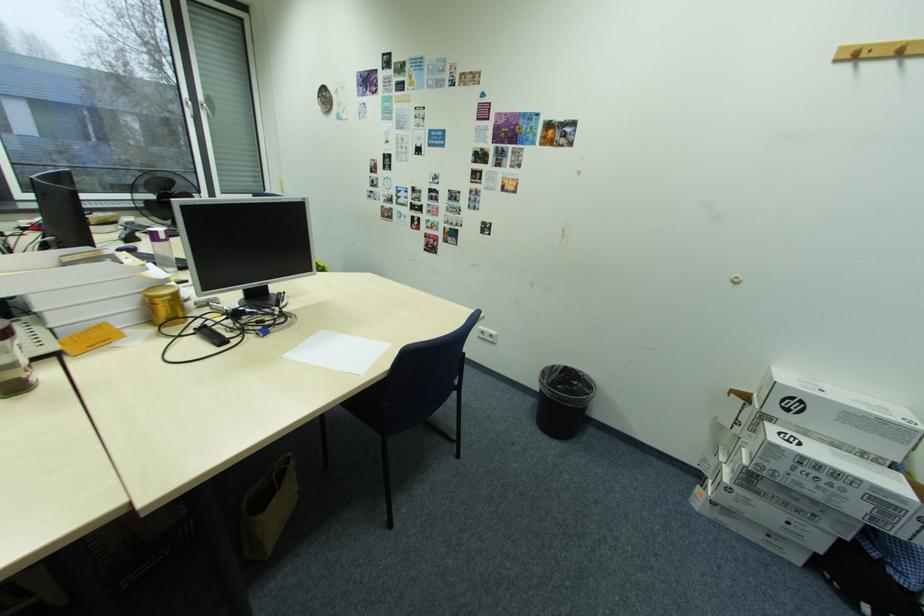
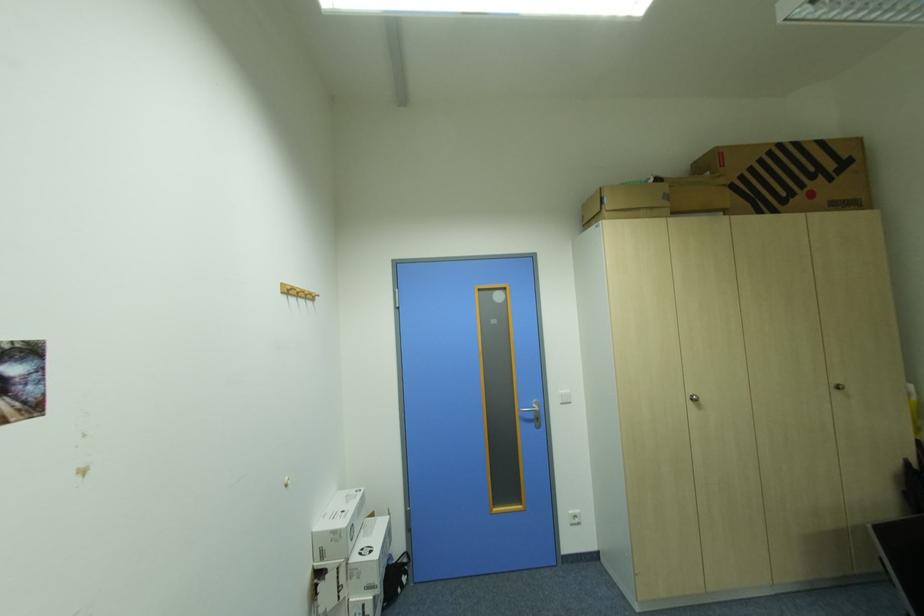
In the second image, find the point that corresponds to (x=843, y=61) in the first image.

(292, 293)